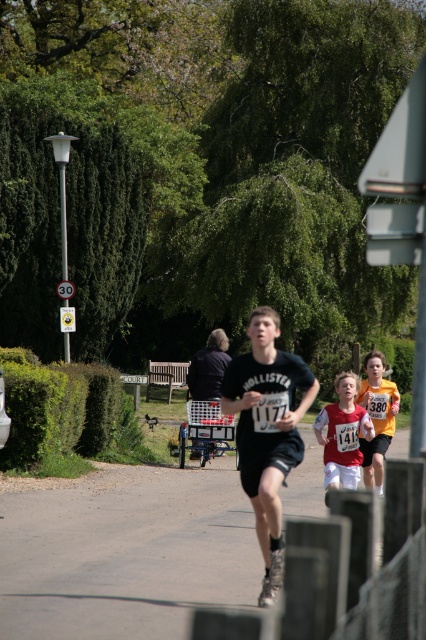
Question: Can you confirm if smooth asphalt road at center is bigger than matte black shirt at center?

Choices:
 (A) no
 (B) yes

Answer: (B)

Question: Can you confirm if black matte t-shirt at center is positioned above matte black shirt at center?

Choices:
 (A) yes
 (B) no

Answer: (B)

Question: Does smooth asphalt road at center appear under black matte t-shirt at center?

Choices:
 (A) no
 (B) yes

Answer: (B)

Question: Which point appears farthest from the camera in this image?

Choices:
 (A) (348, 385)
 (B) (71, 596)

Answer: (A)

Question: Which of the following is the farthest from the observer?

Choices:
 (A) black matte t-shirt at center
 (B) smooth asphalt road at center
 (C) matte black shirt at center

Answer: (C)

Question: Among these objects, which one is farthest from the camera?

Choices:
 (A) black matte t-shirt at center
 (B) matte black shirt at center
 (C) smooth asphalt road at center

Answer: (B)